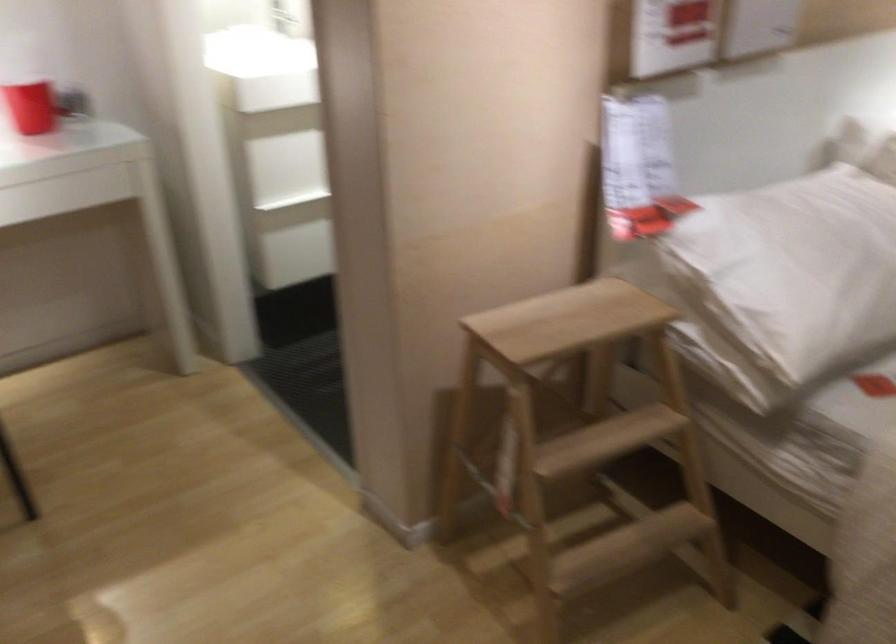
What do you see at coordinates (30, 105) in the screenshot? Image resolution: width=896 pixels, height=644 pixels. I see `the red cup` at bounding box center [30, 105].